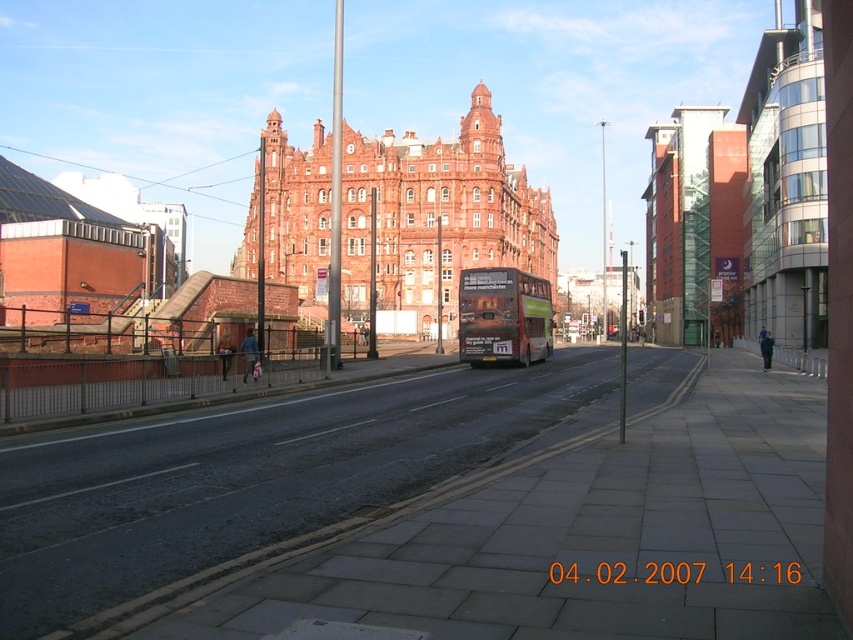
Question: Can you confirm if red brick building at center is positioned to the left of green matte double-decker bus at center?

Choices:
 (A) yes
 (B) no

Answer: (A)

Question: Which object is farther from the camera taking this photo?

Choices:
 (A) red brick building at center
 (B) green matte double-decker bus at center

Answer: (A)

Question: Is red brick building at center further to camera compared to green matte double-decker bus at center?

Choices:
 (A) no
 (B) yes

Answer: (B)

Question: Can you confirm if red brick building at center is thinner than green matte double-decker bus at center?

Choices:
 (A) no
 (B) yes

Answer: (A)

Question: Which object appears farthest from the camera in this image?

Choices:
 (A) red brick building at center
 (B) green matte double-decker bus at center

Answer: (A)